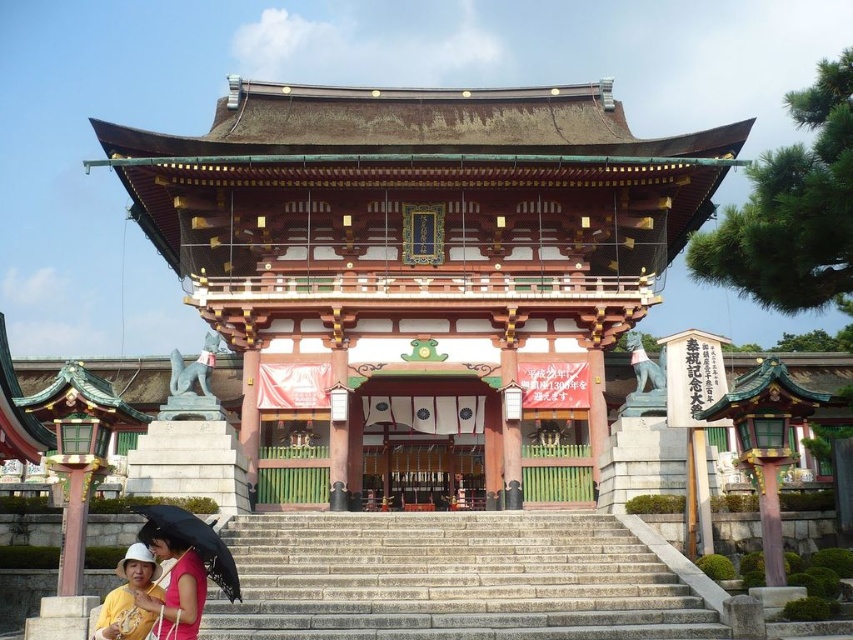
Question: Does gray stone stairs at center appear under black matte umbrella at lower left?

Choices:
 (A) no
 (B) yes

Answer: (B)

Question: Which point is closer to the camera?

Choices:
 (A) (212, 566)
 (B) (517, 632)
 (C) (135, 557)
 (D) (560, 333)

Answer: (C)

Question: Which object appears closest to the camera in this image?

Choices:
 (A) matte yellow shirt at lower left
 (B) gray stone stairs at center
 (C) shiny bronze gate at center
 (D) black matte umbrella at lower left

Answer: (D)

Question: Does shiny bronze gate at center appear over gray stone stairs at center?

Choices:
 (A) no
 (B) yes

Answer: (B)

Question: Where is gray stone stairs at center located in relation to matte yellow shirt at lower left in the image?

Choices:
 (A) left
 (B) right

Answer: (B)

Question: Among these objects, which one is farthest from the camera?

Choices:
 (A) gray stone stairs at center
 (B) shiny bronze gate at center
 (C) black matte umbrella at lower left

Answer: (B)